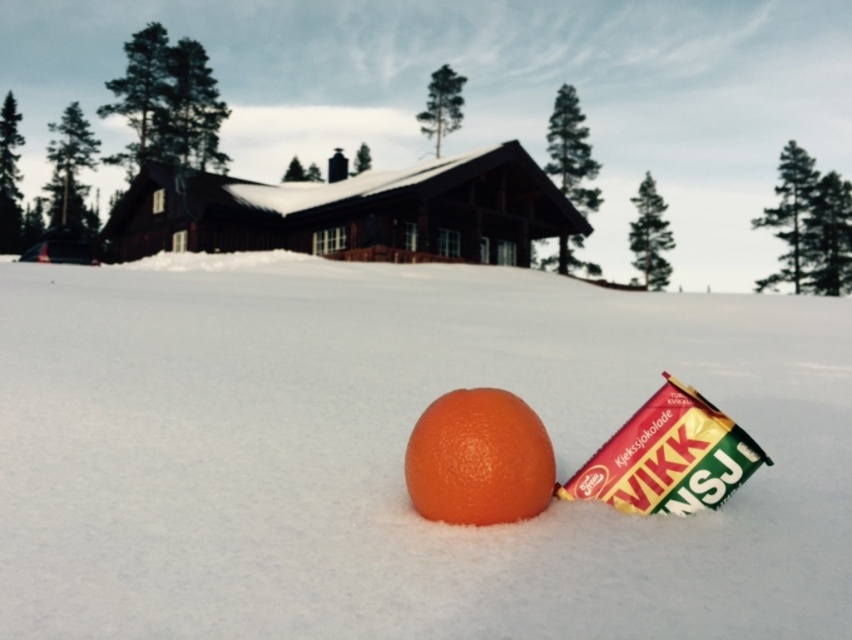
Question: Does white fluffy snow at center lie in front of orange matte at center?

Choices:
 (A) no
 (B) yes

Answer: (B)

Question: Can you confirm if white fluffy snow at center is wider than orange matte at center?

Choices:
 (A) yes
 (B) no

Answer: (A)

Question: Is white fluffy snow at center in front of orange matte at center?

Choices:
 (A) no
 (B) yes

Answer: (B)

Question: Among these objects, which one is farthest from the camera?

Choices:
 (A) white fluffy snow at center
 (B) orange matte at center

Answer: (B)